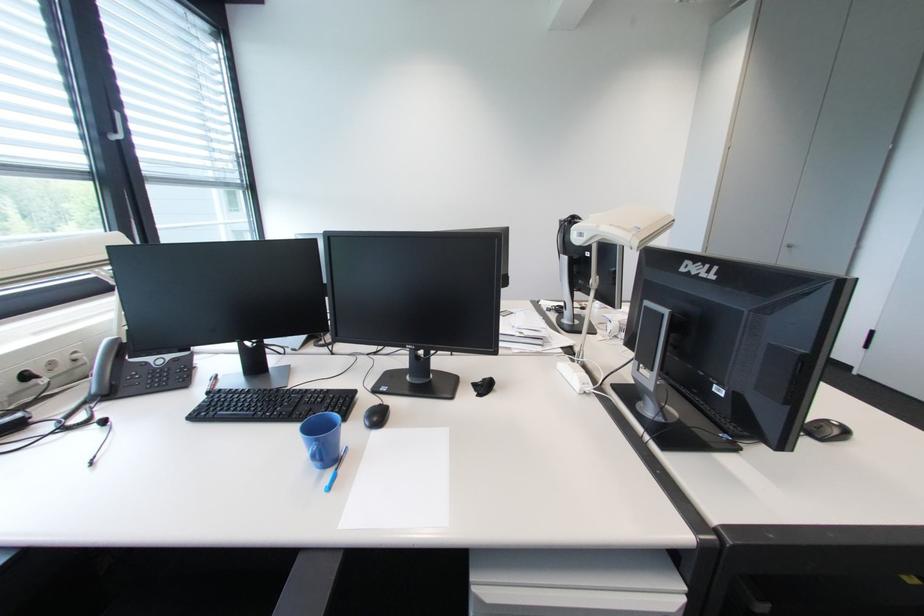
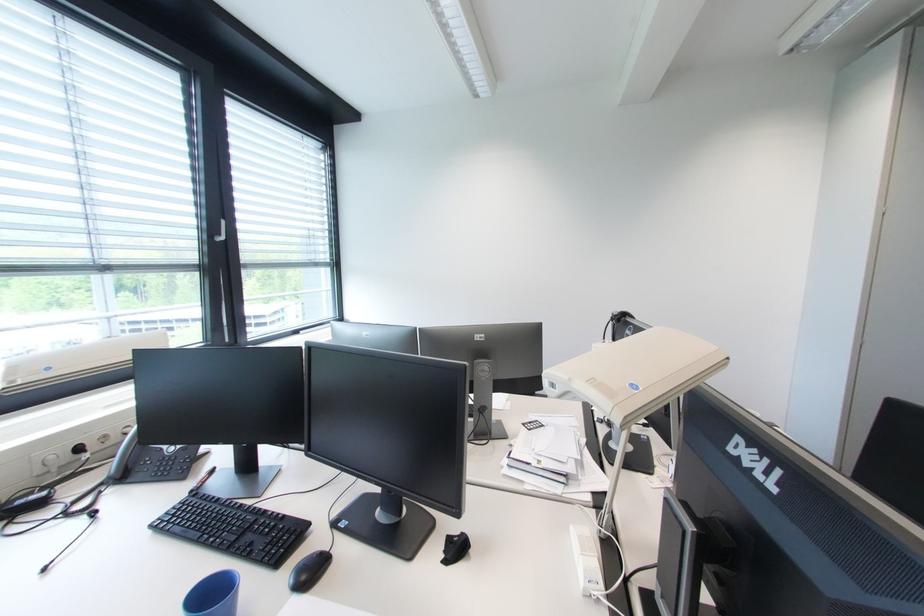
Which direction would the cameraman need to move to produce the second image?

The movement direction of the cameraman is right, forward.